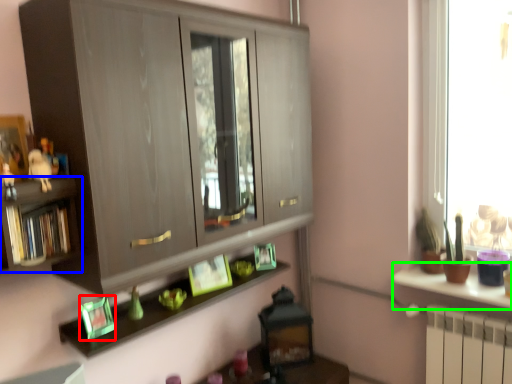
Question: Based on their relative distances, which object is nearer to picture frame (highlighted by a red box)? Choose from shelf (highlighted by a blue box) and counter (highlighted by a green box).

Choices:
 (A) shelf
 (B) counter

Answer: (A)